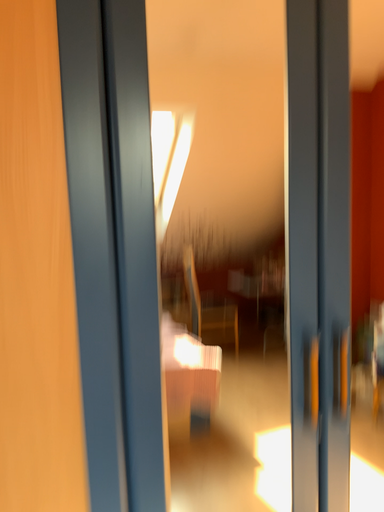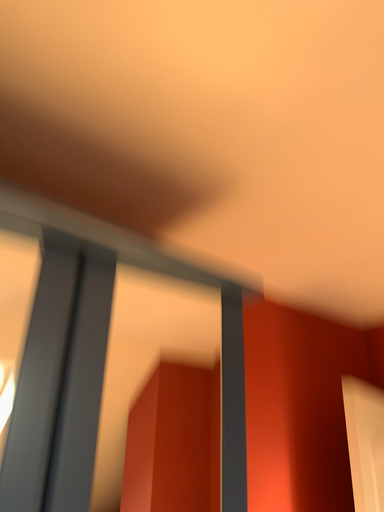
Question: Which way did the camera rotate in the video?

Choices:
 (A) rotated downward
 (B) rotated upward

Answer: (B)